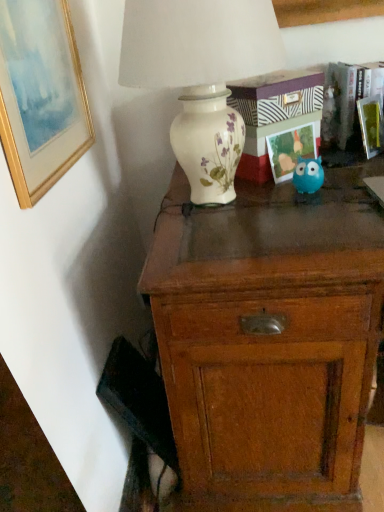
Locate an element on the screen. vacant region to the right of matte plastic picture frame at upper right, acting as the second picture frame starting from the left is located at coordinates (345, 170).